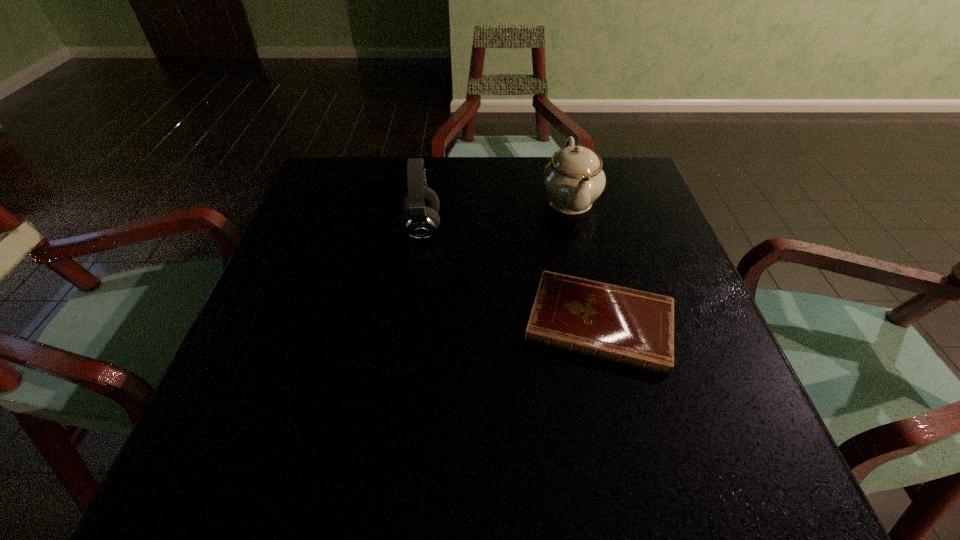
The height and width of the screenshot is (540, 960). What are the coordinates of `the leftmost object` in the screenshot? It's located at (420, 219).

Where is `chinaware`? chinaware is located at coordinates (574, 179).

You are a GUI agent. You are given a task and a screenshot of the screen. Output one action in this format:
    pyautogui.click(x=<x>, y=<y>)
    Task: Click on the nearest object
    This screenshot has width=960, height=540.
    Given the screenshot: What is the action you would take?
    pyautogui.click(x=633, y=327)

Where is `notebook`? Image resolution: width=960 pixels, height=540 pixels. notebook is located at coordinates point(633,327).

Identify the location of free region located 0.380m on the ear cups of the leftmost object. (608, 228).

What are the coordinates of `vacant region located 0.310m at the spout of the chinaware` in the screenshot? It's located at (602, 340).

At what (x,y) coordinates should I click in order to perform the action: click on vacant region located 0.290m on the left of the shortest object. Please return your answer as a coordinate pair (x, y). This screenshot has height=540, width=960. Looking at the image, I should click on (368, 323).

Locate an element on the screen. This screenshot has height=540, width=960. headset that is at the far edge is located at coordinates (420, 219).

You are a GUI agent. You are given a task and a screenshot of the screen. Output one action in this format:
    pyautogui.click(x=<x>, y=<y>)
    Task: Click on the chinaware located at the far edge
    Image resolution: width=960 pixels, height=540 pixels.
    Given the screenshot: What is the action you would take?
    pyautogui.click(x=574, y=179)

This screenshot has height=540, width=960. I want to click on chinaware positioned at the right edge, so click(x=574, y=179).